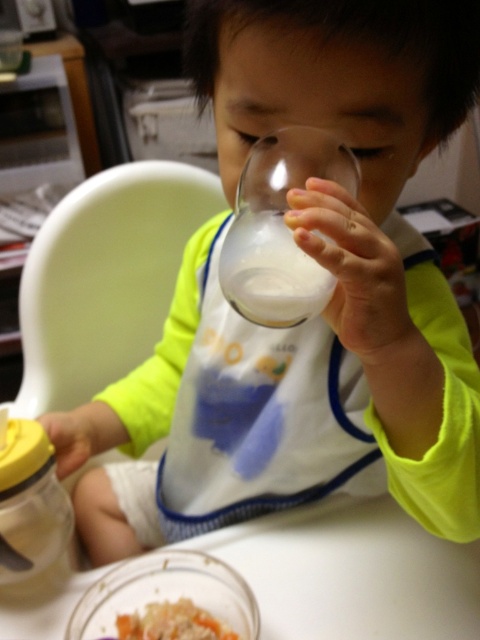
You are a parent standing next to the white plastic table at lower center. You want to place a 18 inch long toy on the table. Can the toy fit on the table?

The white plastic table at lower center and viewer are 20.46 inches apart from each other. Since the toy is 18 inches long, it can fit on the table as the distance between the table and viewer does not affect the table size.

You are a parent trying to place a new plate on the table. The plate is as wide as the smooth brown rice at lower center. Will the plate fit on the white plastic table at lower center?

The white plastic table at lower center is wider than the smooth brown rice at lower center, so the plate will fit on the table since the table is wider than the rice.

Based on the photo, you are a photographer taking a closeup shot of the child in the high chair. You notice two points in your viewfinder labeled as point 1 and point 2. Point 1 is at coordinate (x=432, y=602) and point 2 is at (x=7, y=468). Which point is closer to your camera lens?

Point 1 at coordinate (x=432, y=602) is closer to the camera lens because it is further to the viewer than point 2 at (x=7, y=468).